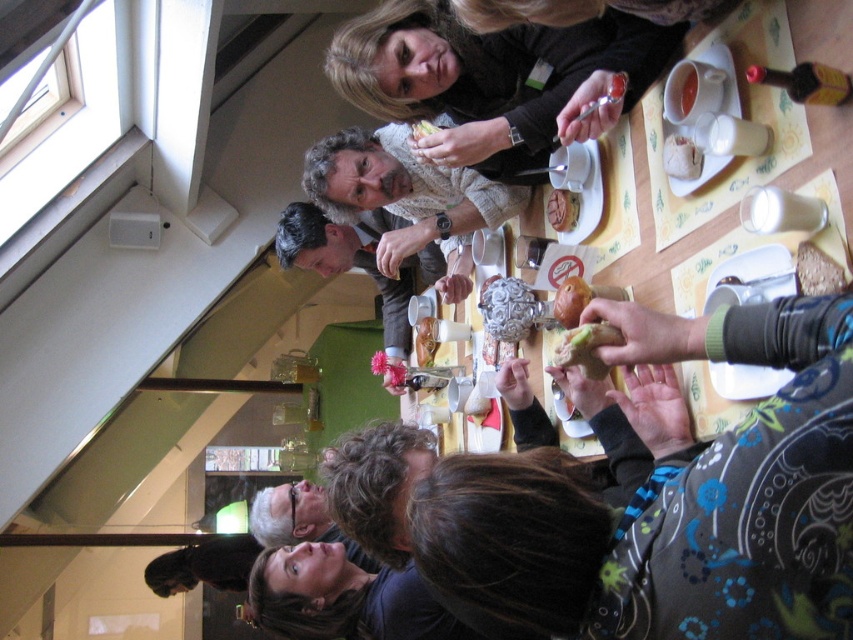
Who is positioned more to the left, wooden table at center or white crumbly bread at upper right?

wooden table at center is more to the left.

Who is higher up, wooden table at center or white crumbly bread at upper right?

white crumbly bread at upper right is above.

Who is more distant from viewer, (778,104) or (665,166)?

Positioned behind is point (665,166).

The width and height of the screenshot is (853, 640). Find the location of `wooden table at center`. wooden table at center is located at coordinates (636, 220).

Which is behind, point (686, 173) or point (570, 324)?

The point (570, 324) is more distant.

What are the coordinates of `white crumbly bread at upper right` in the screenshot? It's located at (682, 157).

Is point (671, 176) more distant than point (575, 301)?

No, (671, 176) is closer to viewer.

The image size is (853, 640). I want to click on white crumbly bread at upper right, so click(x=682, y=157).

Between point (683, 148) and point (421, 132), which one is positioned behind?

The point (421, 132) is behind.

Looking at this image, measure the distance between white crumbly bread at upper right and smooth yellow cheese at center.

white crumbly bread at upper right and smooth yellow cheese at center are 29.39 inches apart.

The image size is (853, 640). What do you see at coordinates (682, 157) in the screenshot?
I see `white crumbly bread at upper right` at bounding box center [682, 157].

This screenshot has width=853, height=640. I want to click on white crumbly bread at upper right, so click(682, 157).